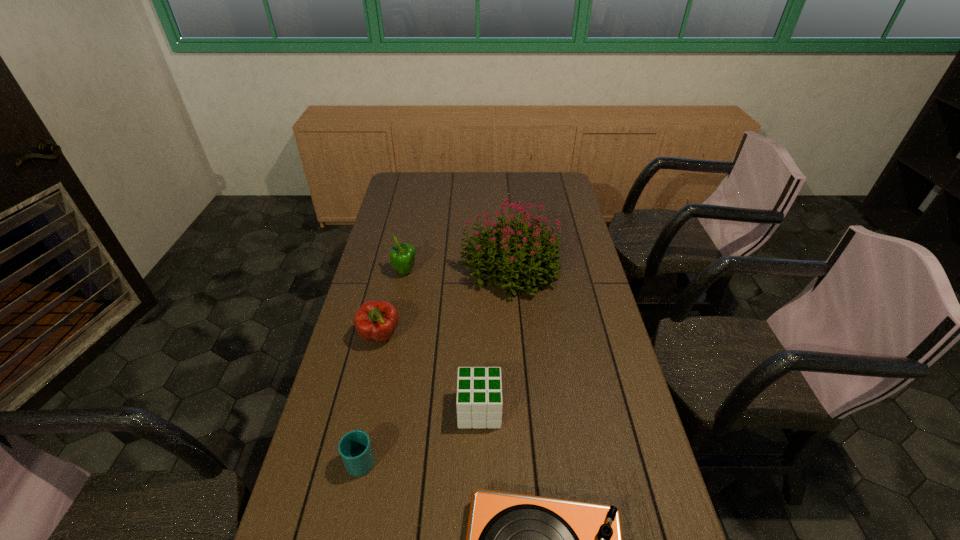
This screenshot has height=540, width=960. Find the location of `vacant area that lies between the third farthest object and the tallest object`. vacant area that lies between the third farthest object and the tallest object is located at coordinates (445, 302).

This screenshot has width=960, height=540. What are the coordinates of `vacant area between the fourth farthest object and the farther bell pepper` in the screenshot? It's located at (443, 341).

You are a GUI agent. You are given a task and a screenshot of the screen. Output one action in this format:
    pyautogui.click(x=<x>, y=<y>)
    Task: Click on the vacant space in between the farther bell pepper and the shorter bell pepper
    This screenshot has height=540, width=960.
    Given the screenshot: What is the action you would take?
    pyautogui.click(x=393, y=304)

You are a GUI agent. You are given a task and a screenshot of the screen. Output one action in this format:
    pyautogui.click(x=<x>, y=<y>)
    Task: Click on the free space between the farther bell pepper and the fourth farthest object
    
    Given the screenshot: What is the action you would take?
    pyautogui.click(x=443, y=341)

Locate an element on the screen. The height and width of the screenshot is (540, 960). vacant area between the tallest object and the farther bell pepper is located at coordinates (458, 270).

Image resolution: width=960 pixels, height=540 pixels. I want to click on free space that is in between the tallest object and the fourth farthest object, so click(x=494, y=339).

The width and height of the screenshot is (960, 540). I want to click on vacant space in between the farther bell pepper and the bouquet, so click(x=458, y=270).

This screenshot has width=960, height=540. Find the location of `object that is the fourth closest one to the farther bell pepper`. object that is the fourth closest one to the farther bell pepper is located at coordinates (355, 449).

Choose which object is the second nearest neighbor to the shorter bell pepper. Please provide its 2D coordinates. Your answer should be formatted as a tuple, i.e. [(x, y)], where the tuple contains the x and y coordinates of a point satisfying the conditions above.

[(402, 256)]